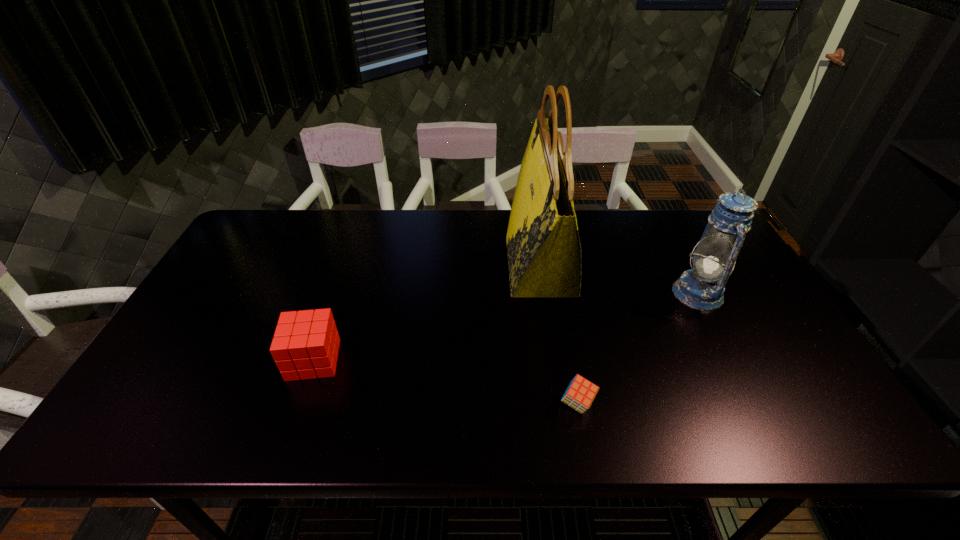
Image resolution: width=960 pixels, height=540 pixels. What are the coordinates of `vacant space at the left edge of the desktop` in the screenshot? It's located at (204, 338).

At what (x,y) coordinates should I click in order to perform the action: click on free space at the right edge of the desktop. Please return your answer as a coordinate pair (x, y). The height and width of the screenshot is (540, 960). Looking at the image, I should click on (748, 338).

Locate an element on the screen. This screenshot has width=960, height=540. vacant space at the far left corner of the desktop is located at coordinates (281, 218).

Identify the location of vacant space at the near right corner. (787, 420).

I want to click on free space between the rightmost object and the taller cube, so click(x=506, y=327).

Where is `empty space that is in between the shorter cube and the leftmost object`? This screenshot has width=960, height=540. empty space that is in between the shorter cube and the leftmost object is located at coordinates (445, 382).

The width and height of the screenshot is (960, 540). I want to click on vacant region between the tallest object and the third shortest object, so click(619, 279).

You are a GUI agent. You are given a task and a screenshot of the screen. Output one action in this format:
    pyautogui.click(x=<x>, y=<y>)
    Task: Click on the vacant point located between the right cube and the lantern
    This screenshot has height=540, width=960.
    Given the screenshot: What is the action you would take?
    pyautogui.click(x=637, y=348)

Locate an element on the screen. The height and width of the screenshot is (540, 960). vacant space that's between the rightmost object and the left cube is located at coordinates (506, 327).

Locate an element on the screen. unoccupied area between the tote bag and the third tallest object is located at coordinates (427, 313).